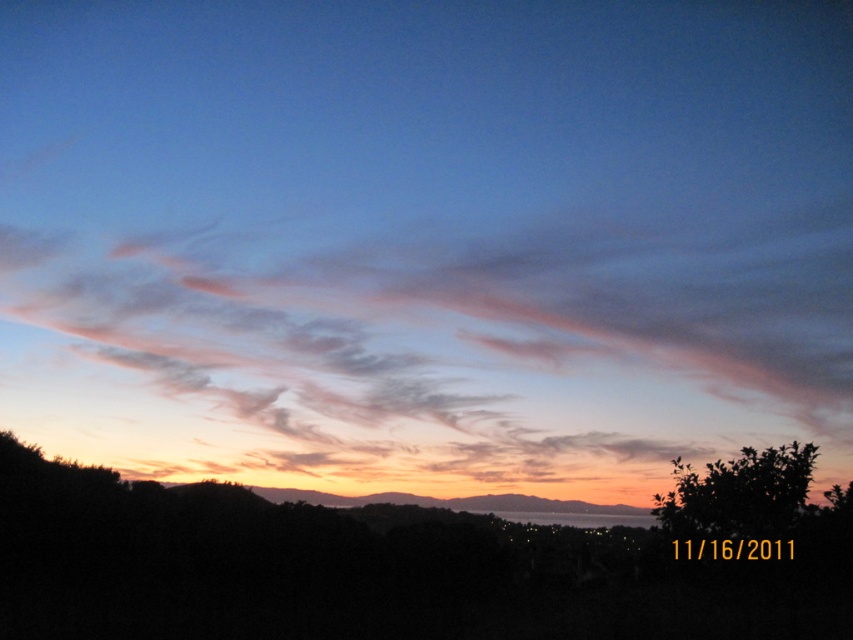
You are an astronomer observing the sunset and want to determine the relative positions of the pink translucent clouds at upper center and the green leafy tree at lower right. Which object is closer to your viewpoint?

The pink translucent clouds at upper center are closer to the viewer than the green leafy tree at lower right because they appear in front of the tree in the scene.

You are an astronomer observing the sunset scene. You notice the pink translucent clouds at upper center and the green leafy tree at lower right. Which object is positioned higher in the sky?

The pink translucent clouds at upper center are positioned higher in the sky than the green leafy tree at lower right.